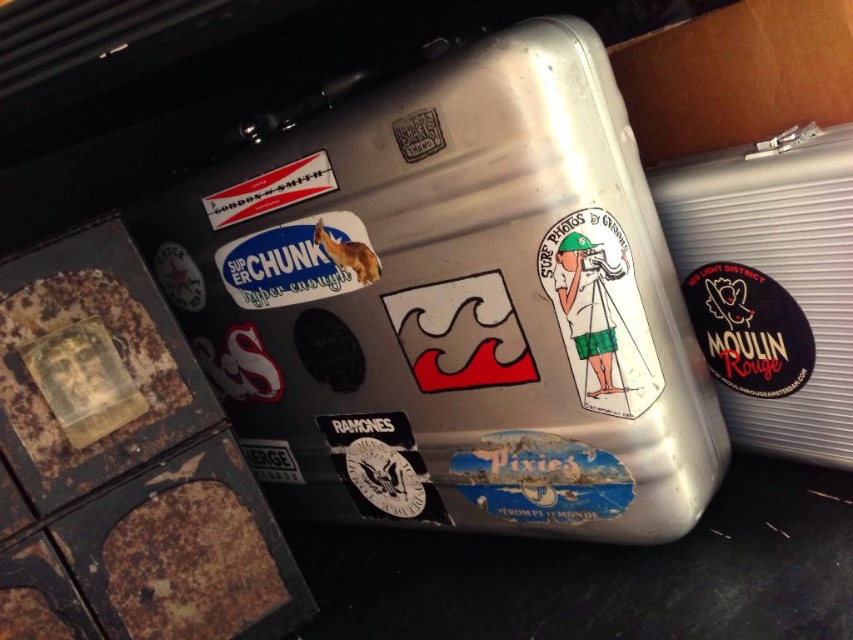
Is point (796, 381) farther from viewer compared to point (326, 275)?

No, (796, 381) is in front of (326, 275).

Is black matte sticker at right taller than matte white sticker at center?

Indeed, black matte sticker at right has a greater height compared to matte white sticker at center.

Does point (804, 316) lie in front of point (280, 294)?

Yes, it is in front of point (280, 294).

Identify the location of black matte sticker at right. The image size is (853, 640). (749, 330).

Between brushed metal cooler at center and silver metallic cooler at right, which one is positioned lower?

brushed metal cooler at center is below.

Between brushed metal cooler at center and silver metallic cooler at right, which one has less height?

silver metallic cooler at right

Is point (512, 282) positioned before point (831, 193)?

That is False.

The image size is (853, 640). Find the location of `brushed metal cooler at center`. brushed metal cooler at center is located at coordinates (456, 307).

Between black matte sticker at right and white matte sticker at upper left, which one appears on the right side from the viewer's perspective?

Positioned to the right is black matte sticker at right.

Can you confirm if black matte sticker at right is positioned to the right of white matte sticker at upper left?

Yes, black matte sticker at right is to the right of white matte sticker at upper left.

What do you see at coordinates (749, 330) in the screenshot? I see `black matte sticker at right` at bounding box center [749, 330].

Locate an element on the screen. This screenshot has width=853, height=640. black matte sticker at right is located at coordinates (749, 330).